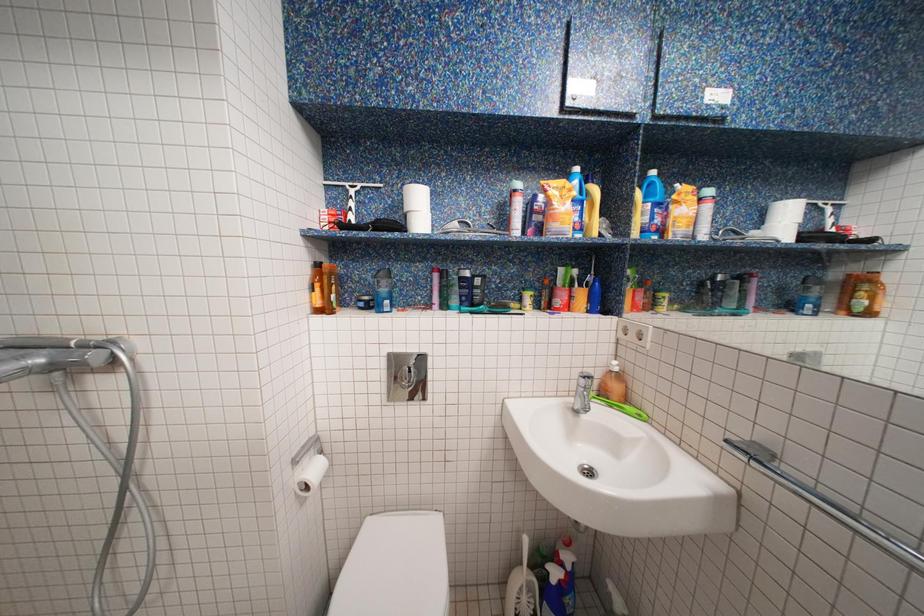
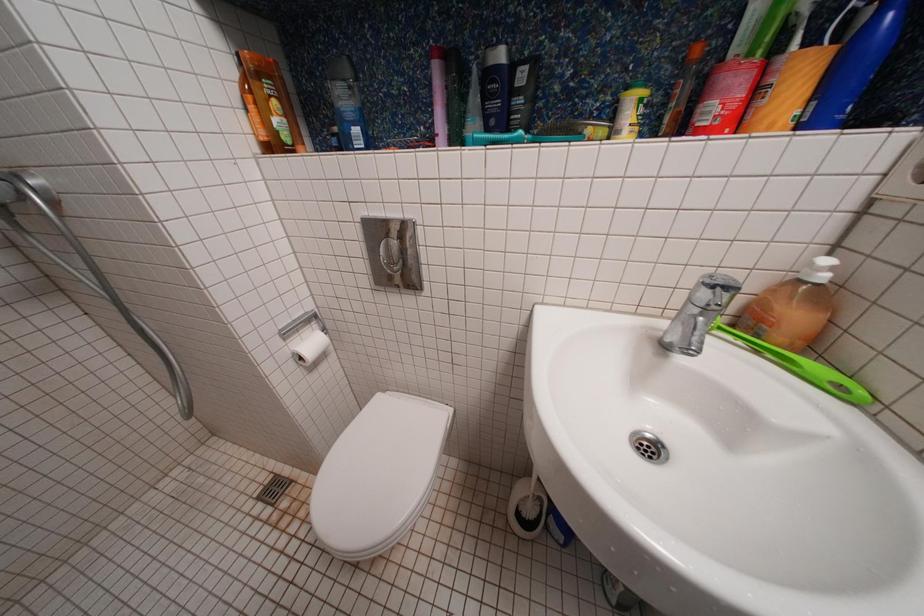
Based on the continuous images, in which direction is the camera rotating?

The camera rotated toward left-down.